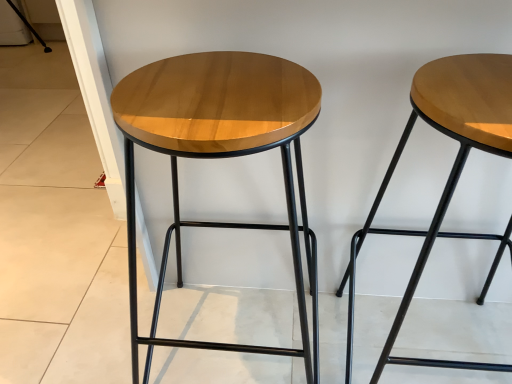
The image size is (512, 384). I want to click on vacant space positioned to the left of wooden stool at center, arranged as the first stool when viewed from the left, so click(x=97, y=322).